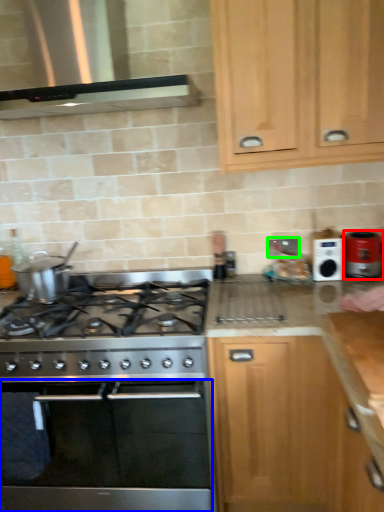
Question: Which is farther away from kitchen appliance (highlighted by a red box)? oven (highlighted by a blue box) or electric outlet (highlighted by a green box)?

Choices:
 (A) oven
 (B) electric outlet

Answer: (A)